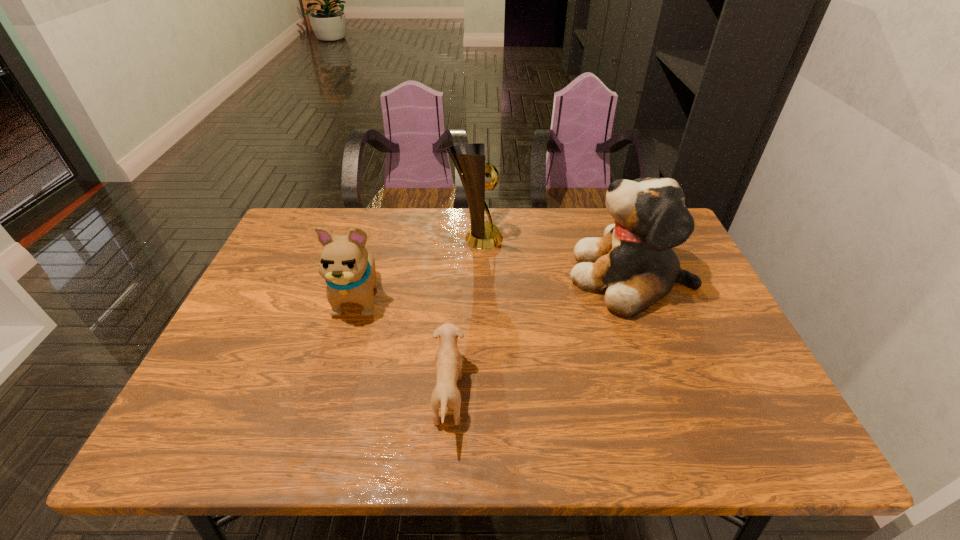
I want to click on award, so click(x=471, y=168).

The width and height of the screenshot is (960, 540). Identify the location of the rightmost puppy. [633, 263].

Identify the location of the leftmost puppy. (349, 270).

The height and width of the screenshot is (540, 960). I want to click on the third tallest object, so click(x=349, y=270).

This screenshot has width=960, height=540. In order to click on the nearest puppy in this screenshot , I will do `click(448, 362)`.

You are a GUI agent. You are given a task and a screenshot of the screen. Output one action in this format:
    pyautogui.click(x=<x>, y=<y>)
    Task: Click on the second puppy from left to right
    The height and width of the screenshot is (540, 960).
    Given the screenshot: What is the action you would take?
    pyautogui.click(x=448, y=362)

Identify the location of free space located at the front of the award, where the globe is visible. The width and height of the screenshot is (960, 540). (519, 239).

Identify the location of free space located at the face of the rightmost object. (486, 276).

Locate an element on the screen. This screenshot has width=960, height=540. vacant area situated at the face of the rightmost object is located at coordinates (468, 276).

Identify the location of free space located at the face of the rightmost object. (471, 276).